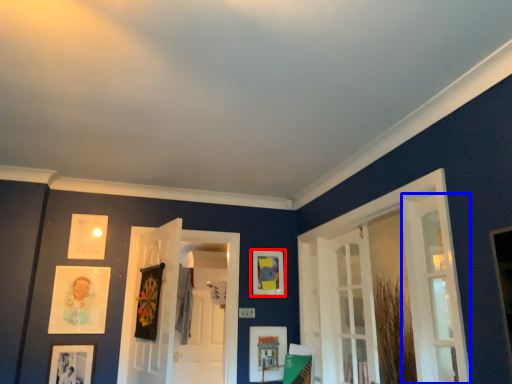
Question: Which object is closer to the camera taking this photo, picture frame (highlighted by a red box) or door (highlighted by a blue box)?

Choices:
 (A) picture frame
 (B) door

Answer: (B)